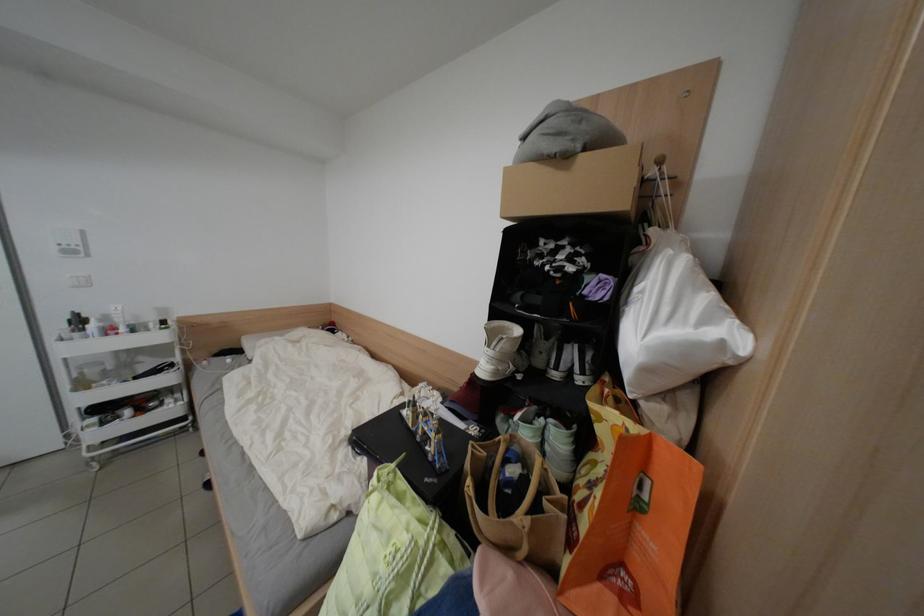
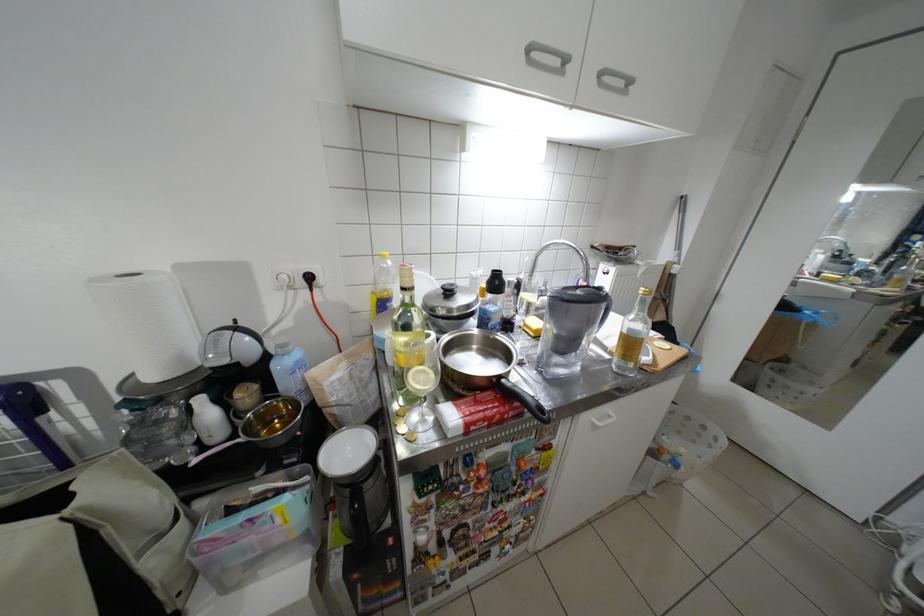
Based on the continuous images, in which direction is the camera rotating?

The camera rotated toward left-down.